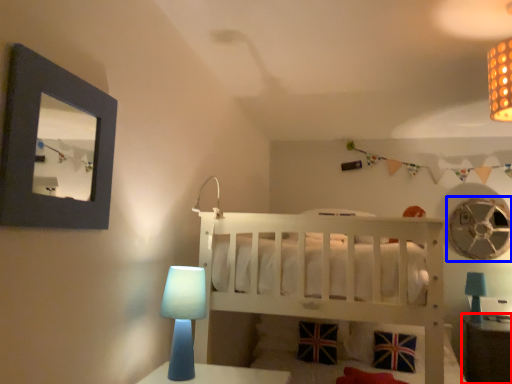
Question: Which of the following is the farthest to the observer, table (highlighted by a red box) or mechanical fan (highlighted by a blue box)?

Choices:
 (A) table
 (B) mechanical fan

Answer: (B)